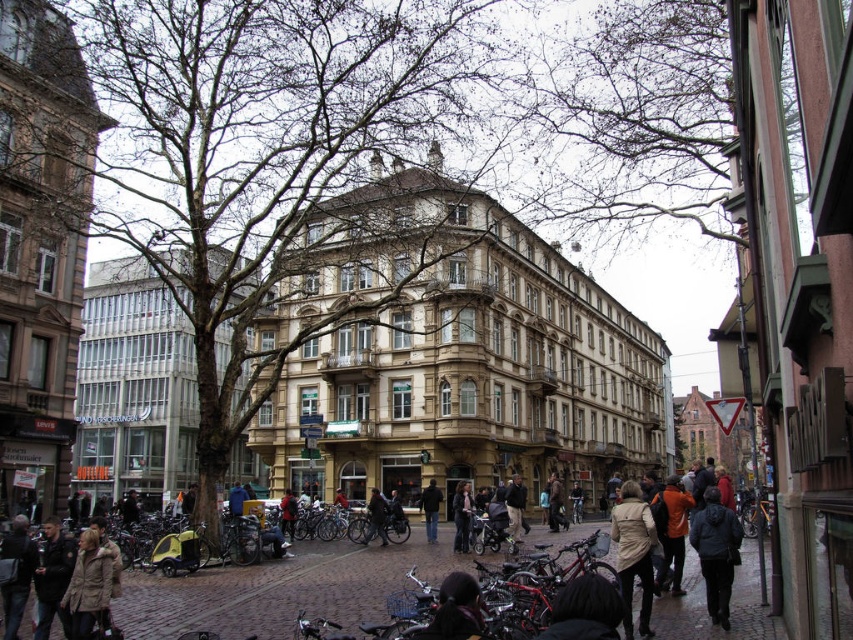
Can you confirm if orange fabric jacket at lower right is positioned to the right of dark gray jacket at center?

Correct, you'll find orange fabric jacket at lower right to the right of dark gray jacket at center.

Does orange fabric jacket at lower right have a lesser width compared to dark gray jacket at center?

Incorrect, orange fabric jacket at lower right's width is not less than dark gray jacket at center's.

Who is more forward, (669, 529) or (456, 528)?

Positioned in front is point (669, 529).

The image size is (853, 640). What are the coordinates of `orange fabric jacket at lower right` in the screenshot? It's located at (672, 532).

Can you confirm if beige fabric jacket at lower right is thinner than dark gray jacket at lower right?

Incorrect, beige fabric jacket at lower right's width is not less than dark gray jacket at lower right's.

Is point (624, 572) positioned before point (718, 516)?

Yes, it is.

Where is `beige fabric jacket at lower right`? beige fabric jacket at lower right is located at coordinates (634, 554).

Identify the location of beige fabric jacket at lower right. This screenshot has width=853, height=640. (634, 554).

Looking at this image, can you confirm if khaki fabric jacket at lower left is positioned to the left of dark brown leather jacket at lower left?

No, khaki fabric jacket at lower left is not to the left of dark brown leather jacket at lower left.

Can you confirm if khaki fabric jacket at lower left is thinner than dark brown leather jacket at lower left?

Indeed, khaki fabric jacket at lower left has a lesser width compared to dark brown leather jacket at lower left.

Between point (74, 625) and point (47, 579), which one is positioned behind?

The point (47, 579) is behind.

Locate an element on the screen. The width and height of the screenshot is (853, 640). khaki fabric jacket at lower left is located at coordinates (88, 584).